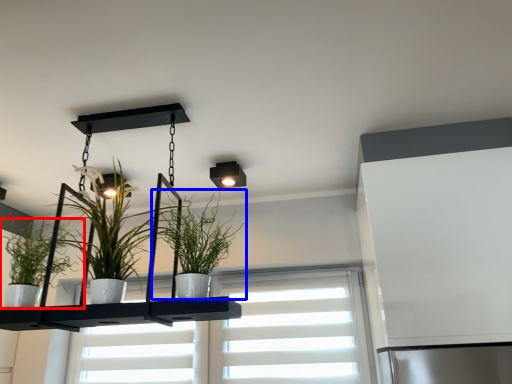
Question: Among these objects, which one is farthest to the camera, houseplant (highlighted by a red box) or houseplant (highlighted by a blue box)?

Choices:
 (A) houseplant
 (B) houseplant

Answer: (A)